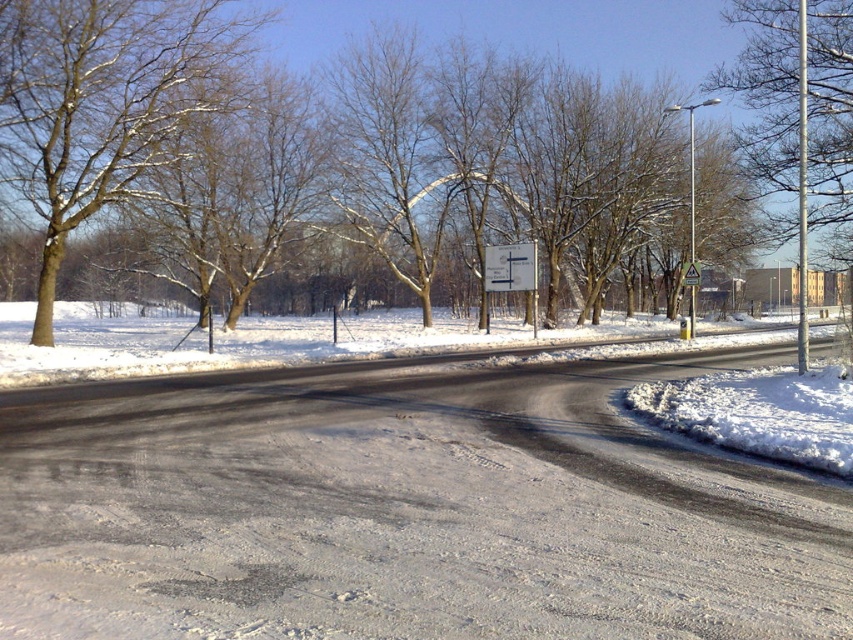
Between white powdery snow at center and white fluffy snow at lower right, which one is positioned lower?

white powdery snow at center is below.

Does white powdery snow at center appear over white fluffy snow at lower right?

Incorrect, white powdery snow at center is not positioned above white fluffy snow at lower right.

Which is in front, point (68, 611) or point (839, 381)?

Positioned in front is point (68, 611).

Locate an element on the screen. The height and width of the screenshot is (640, 853). white powdery snow at center is located at coordinates (405, 509).

Is white fluffy snow at lower right to the right of metallic triangular warning sign at center from the viewer's perspective?

In fact, white fluffy snow at lower right is to the left of metallic triangular warning sign at center.

Which of these two, white fluffy snow at lower right or metallic triangular warning sign at center, stands shorter?

white fluffy snow at lower right

Where is `white fluffy snow at lower right`? white fluffy snow at lower right is located at coordinates (759, 412).

Where is `white fluffy snow at lower right`? Image resolution: width=853 pixels, height=640 pixels. white fluffy snow at lower right is located at coordinates click(x=759, y=412).

Who is lower down, white powdery snow at center or white plastic sign at center?

Positioned lower is white powdery snow at center.

Does white powdery snow at center have a larger size compared to white plastic sign at center?

Indeed, white powdery snow at center has a larger size compared to white plastic sign at center.

Who is more forward, (450, 570) or (508, 275)?

Point (450, 570)

This screenshot has width=853, height=640. What are the coordinates of `white powdery snow at center` in the screenshot? It's located at (405, 509).